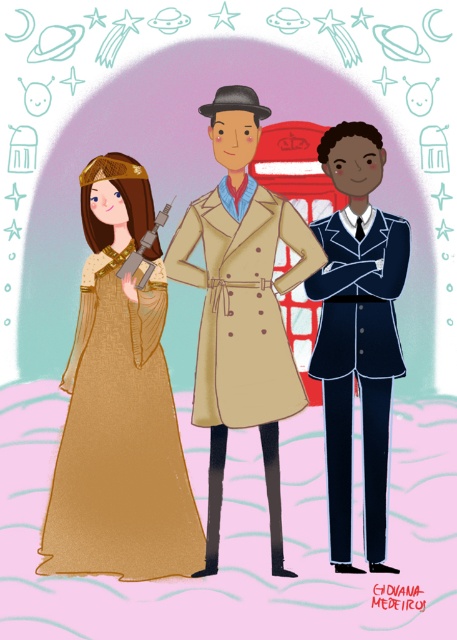
Who is positioned more to the left, matte gold dress at center or beige woolen trench coat at center?

Positioned to the left is matte gold dress at center.

The image size is (457, 640). What do you see at coordinates (120, 404) in the screenshot? I see `matte gold dress at center` at bounding box center [120, 404].

Which is in front, point (160, 515) or point (207, 250)?

Point (160, 515)

The width and height of the screenshot is (457, 640). I want to click on matte gold dress at center, so click(x=120, y=404).

Does point (104, 157) come in front of point (129, 472)?

No, it is behind (129, 472).

Can you confirm if matte gold dress at left is taller than matte gold dress at center?

No.

Find the location of a particular element. Image resolution: width=457 pixels, height=640 pixels. matte gold dress at left is located at coordinates (242, 307).

Can you confirm if dark blue suit at center is positioned to the right of beige woolen trench coat at center?

Yes, dark blue suit at center is to the right of beige woolen trench coat at center.

This screenshot has height=640, width=457. Describe the element at coordinates (357, 332) in the screenshot. I see `dark blue suit at center` at that location.

The width and height of the screenshot is (457, 640). What do you see at coordinates (357, 332) in the screenshot?
I see `dark blue suit at center` at bounding box center [357, 332].

Identify the location of dark blue suit at center. The height and width of the screenshot is (640, 457). (357, 332).